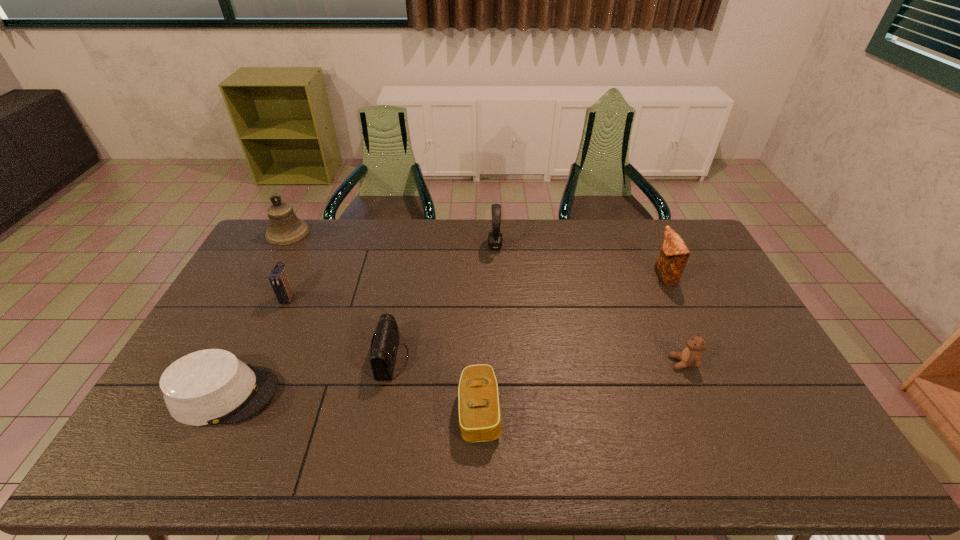
Where is `vacant area at the near edge of the desktop`? vacant area at the near edge of the desktop is located at coordinates (582, 441).

Find the location of a particular element. The height and width of the screenshot is (540, 960). blank space at the left edge is located at coordinates (233, 310).

Find the location of a particular element. vacant position at the right edge of the desktop is located at coordinates (700, 279).

Locate an element on the screen. This screenshot has height=540, width=960. vacant region at the far left corner of the desktop is located at coordinates (307, 222).

Where is `free region at the far right corner of the desktop`? This screenshot has height=540, width=960. free region at the far right corner of the desktop is located at coordinates (669, 220).

Find the location of a particular element. Image resolution: width=960 pixels, height=540 pixels. vacant space that's between the headset and the third clutch bag from right to left is located at coordinates (444, 302).

Find the location of `free space between the second clutch bag from right to left and the fifth object from right to left`. free space between the second clutch bag from right to left and the fifth object from right to left is located at coordinates (436, 385).

The height and width of the screenshot is (540, 960). Find the location of `unoccupied position between the headset and the hat`. unoccupied position between the headset and the hat is located at coordinates (360, 320).

Locate an element on the screen. The width and height of the screenshot is (960, 540). free space between the teddy bear and the fourth object from left to right is located at coordinates (538, 360).

I want to click on free space between the teddy bear and the second clutch bag from left to right, so click(x=538, y=360).